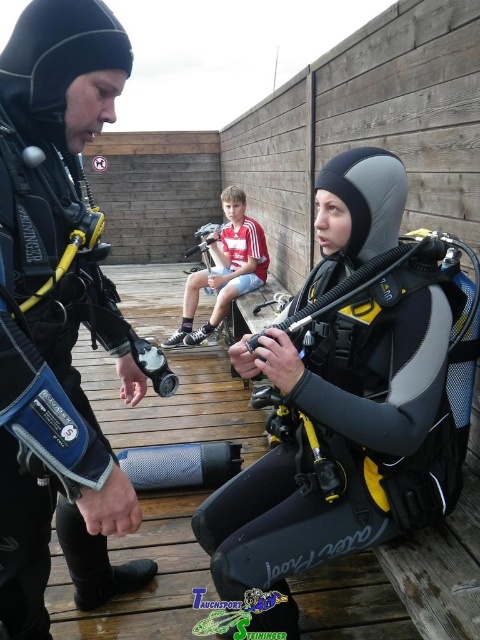
Can you confirm if matte black wetsuit at center is shorter than matte black wetsuit at left?

Yes.

Does point (396, 193) come farther from viewer compared to point (39, 186)?

Yes, point (396, 193) is behind point (39, 186).

Which is behind, point (332, 513) or point (28, 116)?

Point (332, 513)

The height and width of the screenshot is (640, 480). Find the location of `matte black wetsuit at center`. matte black wetsuit at center is located at coordinates (348, 397).

This screenshot has height=640, width=480. Describe the element at coordinates (348, 397) in the screenshot. I see `matte black wetsuit at center` at that location.

What do you see at coordinates (348, 397) in the screenshot? This screenshot has width=480, height=640. I see `matte black wetsuit at center` at bounding box center [348, 397].

The height and width of the screenshot is (640, 480). In order to click on matte black wetsuit at center in this screenshot , I will do `click(348, 397)`.

Does point (87, 524) come in front of point (233, 269)?

That is True.

Locate an element on the screen. The height and width of the screenshot is (640, 480). matte black wetsuit at left is located at coordinates (60, 464).

Where is `matte black wetsuit at left`? matte black wetsuit at left is located at coordinates (60, 464).